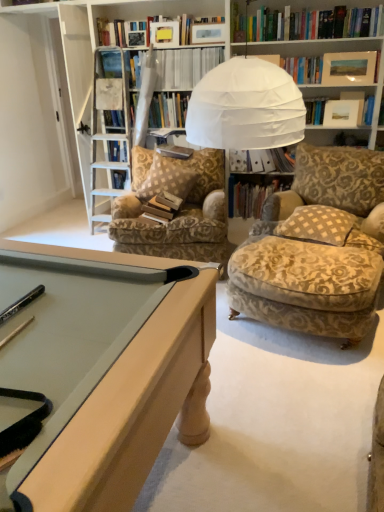
Question: Choose the correct answer: Is velvet beige ottoman at lower right, which is counted as the first chair, starting from the right, inside white paper file at center, the second book viewed from the top, or outside it?

Choices:
 (A) outside
 (B) inside

Answer: (A)

Question: In the image, is velvet beige ottoman at lower right, which is counted as the first chair, starting from the right, positioned in front of or behind white paper file at center, the second book viewed from the top?

Choices:
 (A) front
 (B) behind

Answer: (A)

Question: Considering the real-world distances, which object is farthest from the white paper file at center, arranged as the third book when ordered from the bottom?

Choices:
 (A) patterned fabric chair at center, which is counted as the second chair, starting from the front
 (B) hardcover books at center, which appears as the first book when ordered from the bottom
 (C) matte wooden picture frame at upper right
 (D) light brown wooden pool table at center
 (E) beige checkered pillow at center, the 1th pillow viewed from the front

Answer: (D)

Question: Based on their relative distances, which object is nearer to the beige checkered pillow at center, the 1th pillow viewed from the front?

Choices:
 (A) hardcover books at center, which ranks as the fourth book in top-to-bottom order
 (B) velvet beige ottoman at lower right, acting as the second chair starting from the back
 (C) white paper file at center, the second book viewed from the top
 (D) hardcover book at center, positioned as the 3th book in top-to-bottom order
 (E) brown checkered pillow at center, the second pillow positioned from the right

Answer: (B)